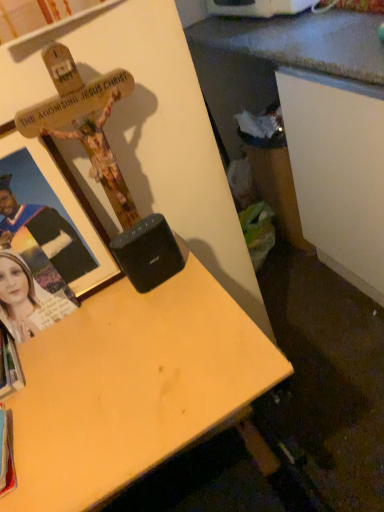
Question: Would you say white paper book at lower left is inside or outside light wood desk at center?

Choices:
 (A) inside
 (B) outside

Answer: (B)

Question: From their relative heights in the image, would you say white paper book at lower left is taller or shorter than light wood desk at center?

Choices:
 (A) short
 (B) tall

Answer: (A)

Question: Estimate the real-world distances between objects in this image. Which object is farther from the wooden cross at upper left?

Choices:
 (A) matte black photo frame at left
 (B) black plastic speaker at center
 (C) light wood desk at center
 (D) white paper book at lower left

Answer: (D)

Question: Considering the real-world distances, which object is closest to the light wood desk at center?

Choices:
 (A) wooden cross at upper left
 (B) matte black photo frame at left
 (C) black plastic speaker at center
 (D) white paper book at lower left

Answer: (C)